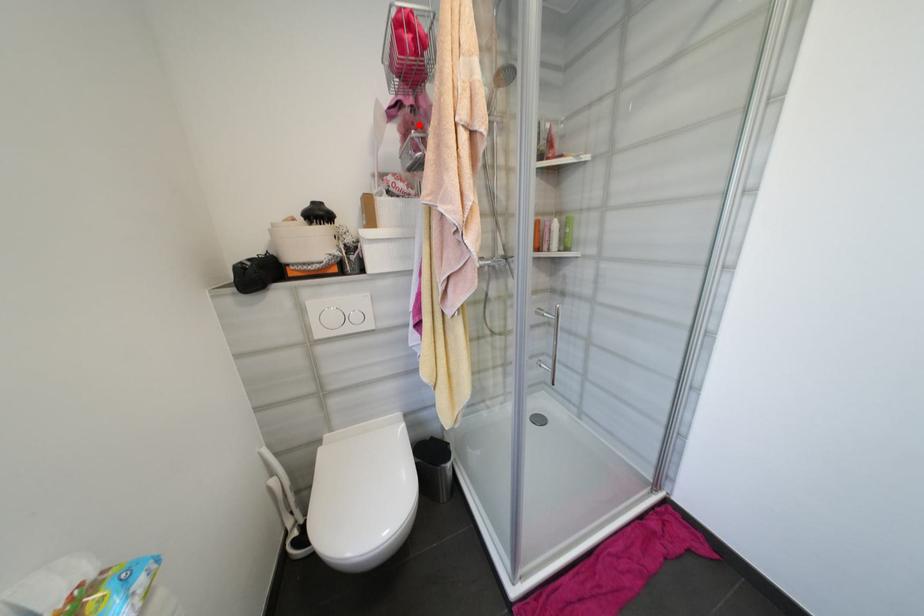
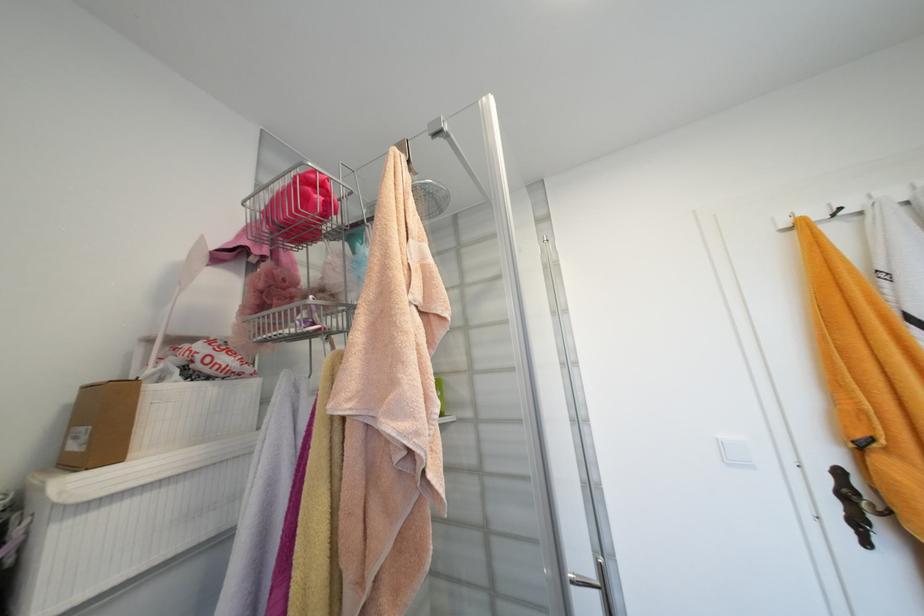
In the second image, find the point that corresponds to the highlighted location in the first image.

(289, 282)